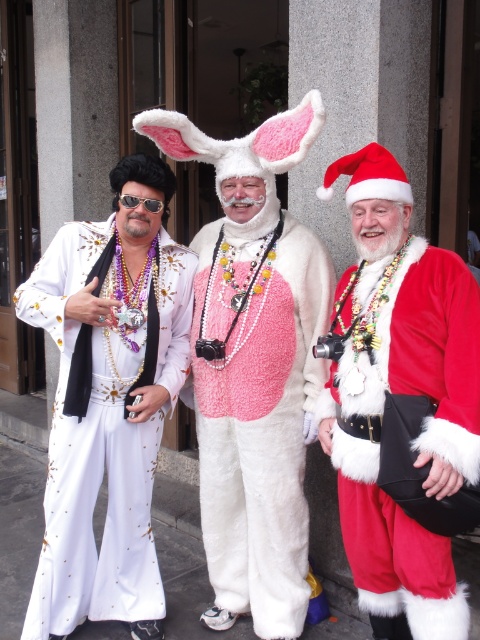
Question: Can you confirm if red velvet santa suit at right is positioned above velvet red santa suit at center?

Choices:
 (A) no
 (B) yes

Answer: (A)

Question: Which of these objects is positioned closest to the white sequined jumpsuit at left?

Choices:
 (A) red velvet santa suit at right
 (B) velvet red santa suit at center

Answer: (B)

Question: Which object is positioned closest to the red velvet santa suit at right?

Choices:
 (A) velvet red santa suit at center
 (B) white sequined jumpsuit at left

Answer: (A)

Question: Does red velvet santa suit at right appear under white sequined jumpsuit at left?

Choices:
 (A) yes
 (B) no

Answer: (B)

Question: Which of these objects is positioned farthest from the white sequined jumpsuit at left?

Choices:
 (A) velvet red santa suit at center
 (B) red velvet santa suit at right

Answer: (B)

Question: Can you confirm if red velvet santa suit at right is thinner than velvet red santa suit at center?

Choices:
 (A) no
 (B) yes

Answer: (B)